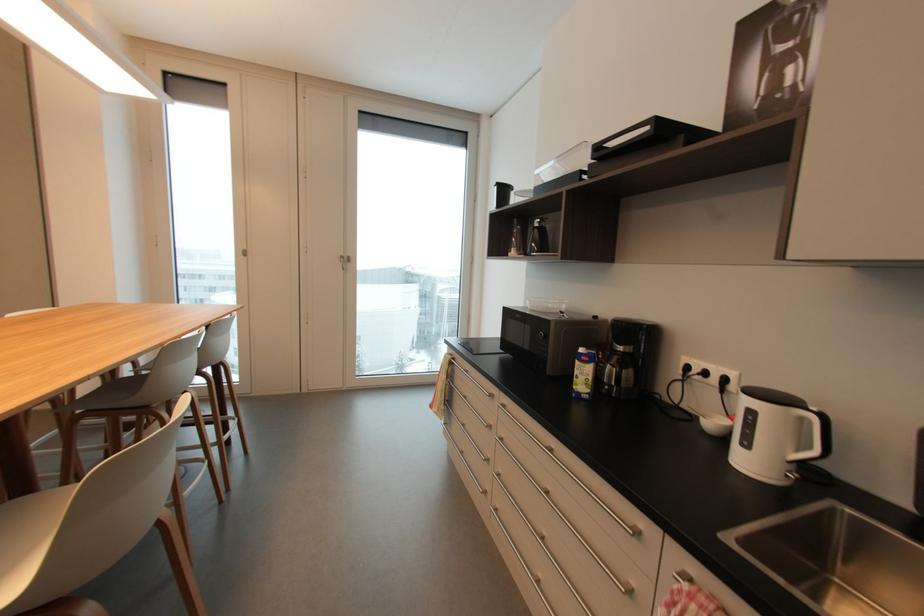
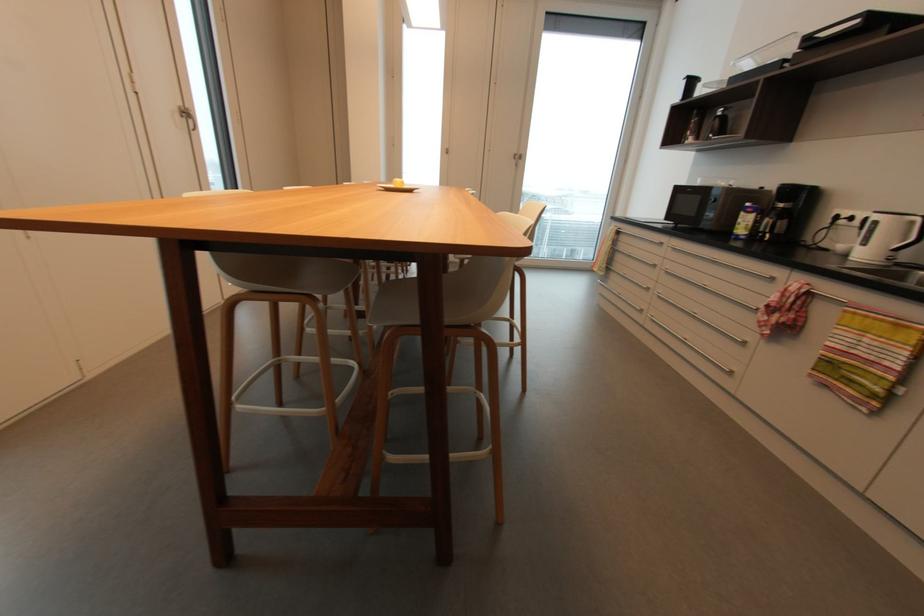
The point at (585, 351) is marked in the first image. Where is the corresponding point in the second image?

(750, 205)